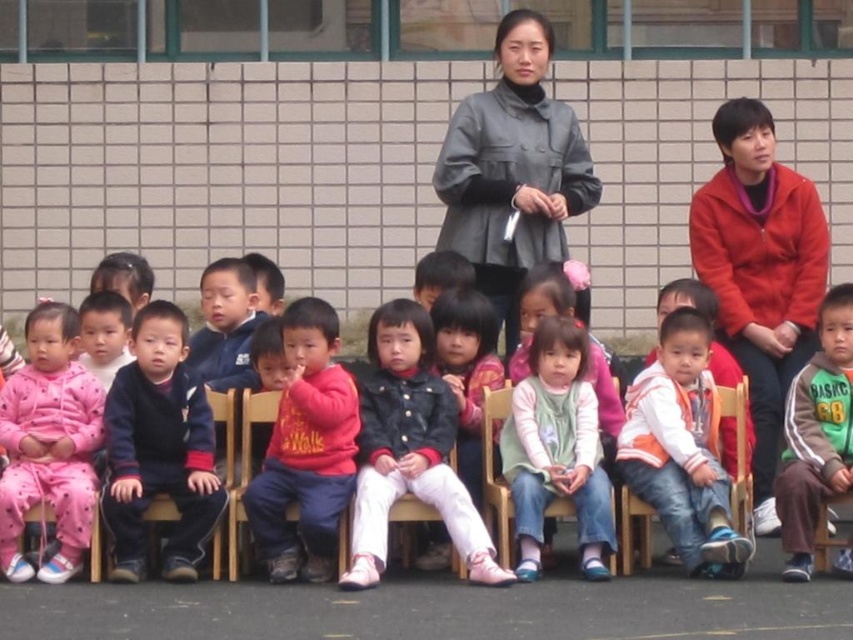
Question: Considering the real-world distances, which object is closest to the matte black jacket at center?

Choices:
 (A) green fleece jacket at lower right
 (B) light green fabric dress at center
 (C) red matte sweater at center
 (D) wooden chair at lower right

Answer: (C)

Question: Does red matte sweater at center have a larger size compared to wooden chair at lower right?

Choices:
 (A) no
 (B) yes

Answer: (B)

Question: Considering the relative positions of matte black jacket at center and dark blue fleece jacket at center in the image provided, where is matte black jacket at center located with respect to dark blue fleece jacket at center?

Choices:
 (A) below
 (B) above

Answer: (A)

Question: Estimate the real-world distances between objects in this image. Which object is farther from the green fleece jacket at lower right?

Choices:
 (A) pink fleece pants at left
 (B) wooden chair at lower right

Answer: (A)

Question: Does pink fleece pants at left come in front of wooden chair at lower right?

Choices:
 (A) yes
 (B) no

Answer: (A)

Question: Which point appears closest to the camera in this image?

Choices:
 (A) (111, 385)
 (B) (329, 573)
 (C) (621, 493)
 (D) (67, 356)

Answer: (B)